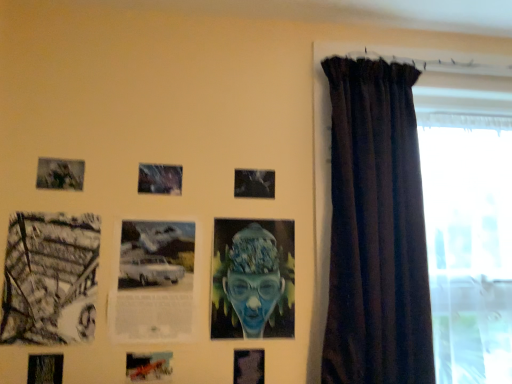
Question: Does blue textured portrait at center come in front of dark velvet curtain at right?

Choices:
 (A) no
 (B) yes

Answer: (A)

Question: Does blue textured portrait at center appear on the left side of dark velvet curtain at right?

Choices:
 (A) no
 (B) yes

Answer: (B)

Question: Is the position of blue textured portrait at center more distant than that of dark velvet curtain at right?

Choices:
 (A) yes
 (B) no

Answer: (A)

Question: Are blue textured portrait at center and dark velvet curtain at right far apart?

Choices:
 (A) no
 (B) yes

Answer: (A)

Question: Is blue textured portrait at center looking in the opposite direction of dark velvet curtain at right?

Choices:
 (A) yes
 (B) no

Answer: (B)

Question: Is blue textured portrait at center completely or partially outside of dark velvet curtain at right?

Choices:
 (A) no
 (B) yes

Answer: (B)

Question: Is dark velvet curtain at right behind metallic silver picture frame at lower center, acting as the fourth picture frame starting from the left?

Choices:
 (A) no
 (B) yes

Answer: (A)

Question: From a real-world perspective, is dark velvet curtain at right beneath metallic silver picture frame at lower center, which is counted as the fifth picture frame, starting from the right?

Choices:
 (A) yes
 (B) no

Answer: (B)

Question: Is dark velvet curtain at right in front of metallic silver picture frame at lower center, acting as the fourth picture frame starting from the left?

Choices:
 (A) no
 (B) yes

Answer: (B)

Question: Is dark velvet curtain at right with metallic silver picture frame at lower center, which is counted as the fifth picture frame, starting from the right?

Choices:
 (A) yes
 (B) no

Answer: (B)

Question: Would you consider dark velvet curtain at right to be distant from metallic silver picture frame at lower center, which is counted as the fifth picture frame, starting from the right?

Choices:
 (A) no
 (B) yes

Answer: (A)

Question: Would you say dark velvet curtain at right contains metallic silver picture frame at lower center, which is counted as the fifth picture frame, starting from the right?

Choices:
 (A) no
 (B) yes

Answer: (A)

Question: Does metallic silver car at center, which is counted as the fifth picture frame, starting from the left, have a lesser width compared to transparent glass window at right?

Choices:
 (A) yes
 (B) no

Answer: (A)